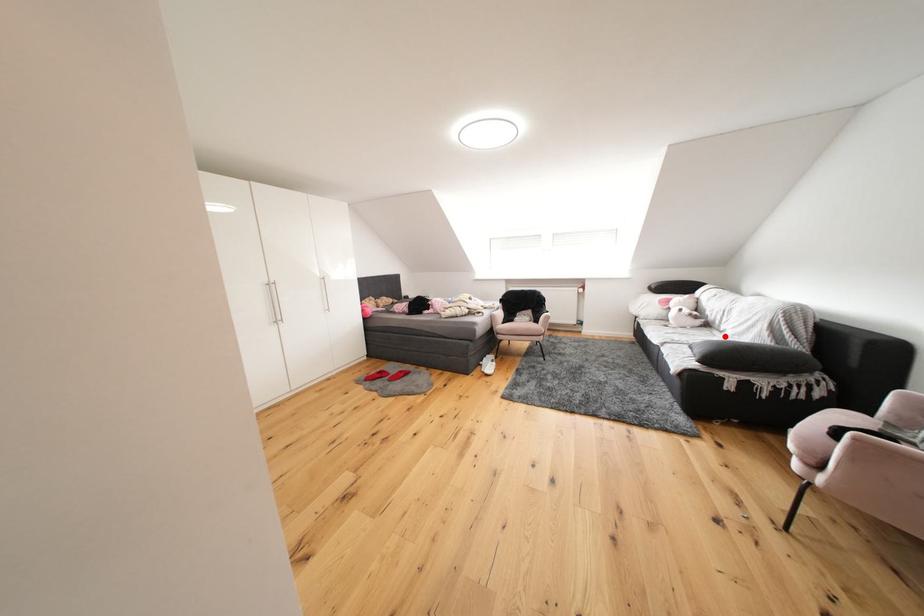
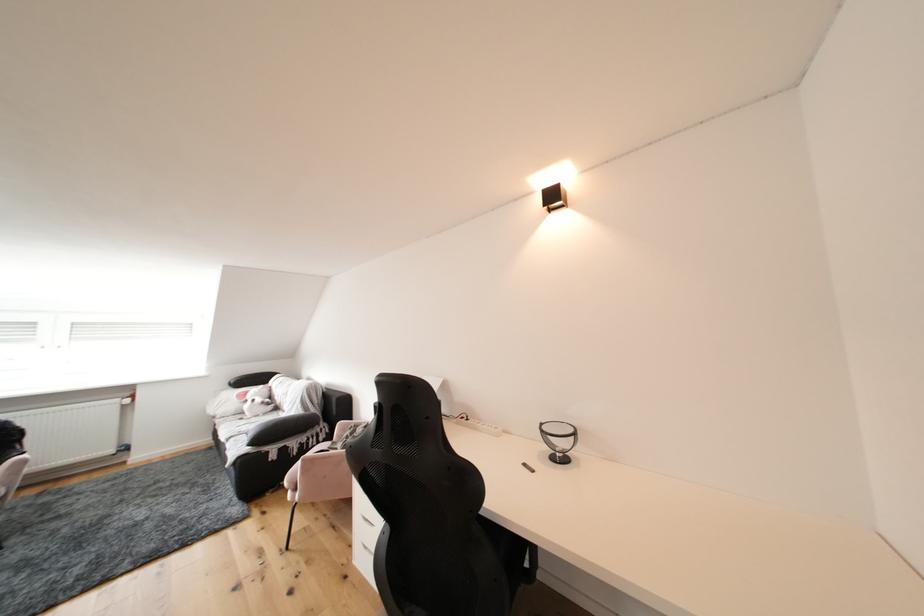
Question: A red point is marked in image1. In image2, is the corresponding 3D point closer to the camera or farther? Reply with the corresponding letter.

Choices:
 (A) The corresponding 3D point is closer.
 (B) The corresponding 3D point is farther.

Answer: (B)